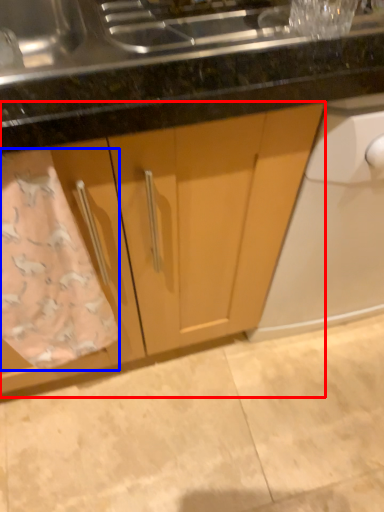
Question: Which of the following is the closest to the observer, cabinetry (highlighted by a red box) or bath towel (highlighted by a blue box)?

Choices:
 (A) cabinetry
 (B) bath towel

Answer: (A)